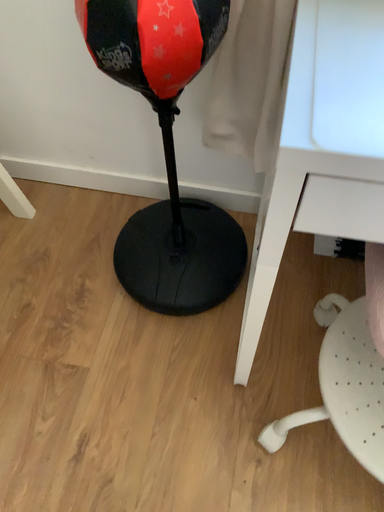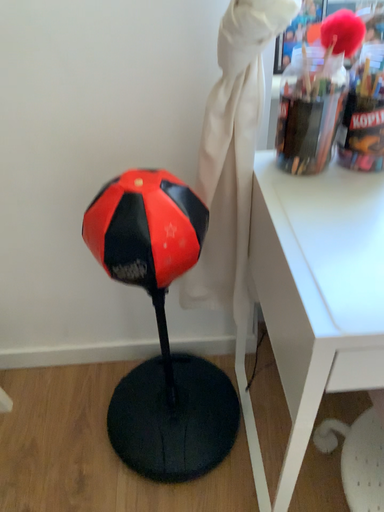
Question: Which way did the camera rotate in the video?

Choices:
 (A) rotated upward
 (B) rotated downward

Answer: (A)